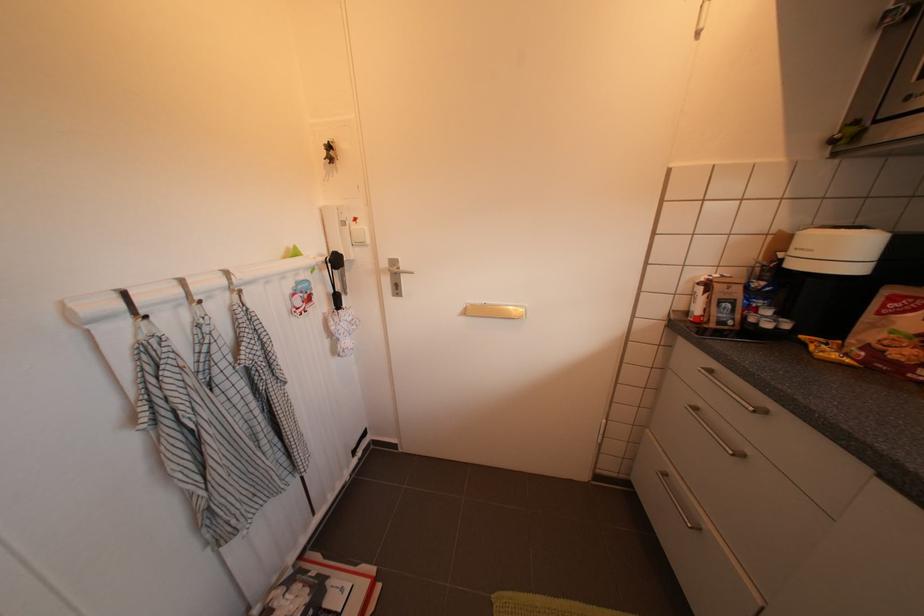
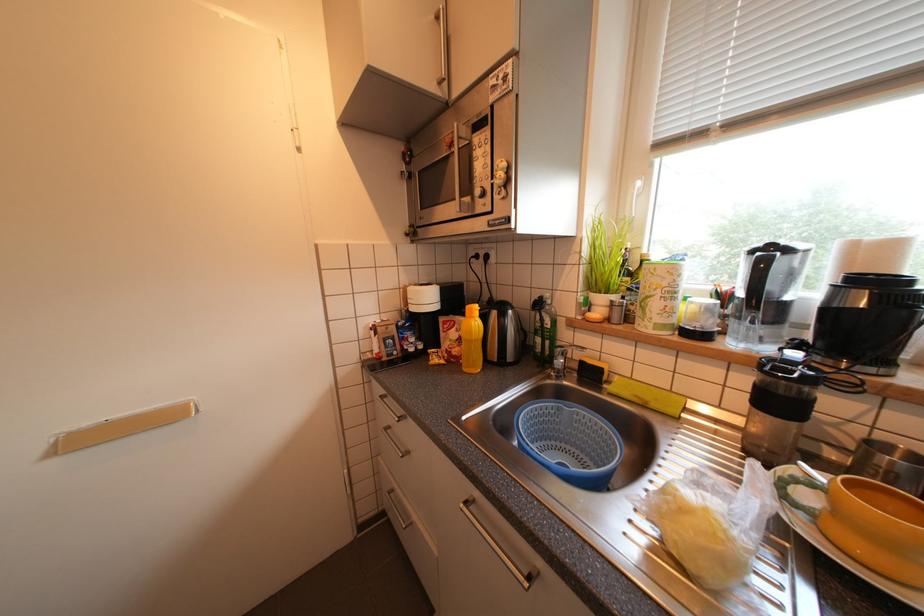
Question: How did the camera likely rotate?

Choices:
 (A) Left
 (B) Right
 (C) Up
 (D) Down

Answer: (B)